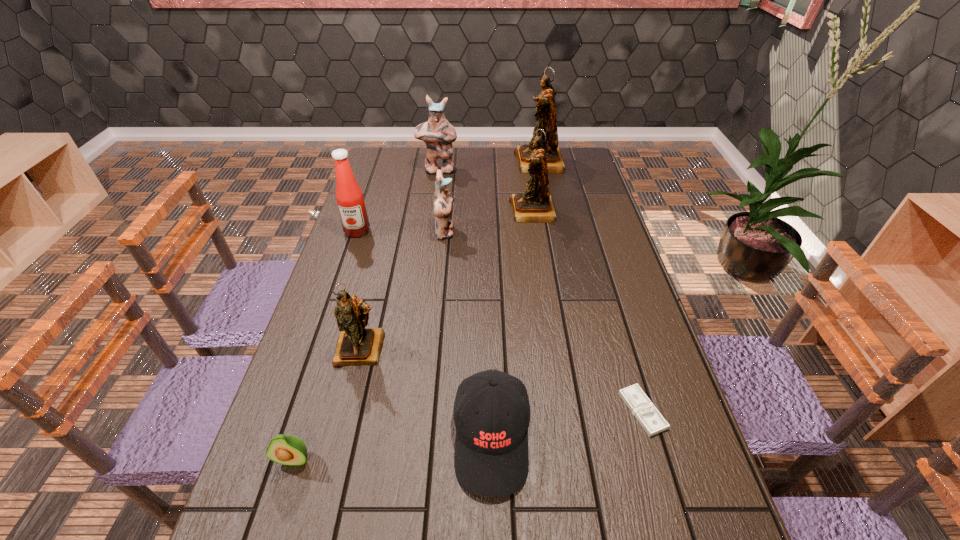
Select which figurine appears as the third closest to the green avocado. Please provide its 2D coordinates. Your answer should be formatted as a tuple, i.e. [(x, y)], where the tuple contains the x and y coordinates of a point satisfying the conditions above.

[(535, 205)]

Select which figurine is the second closest to the second biggest gold figurine. Please provide its 2D coordinates. Your answer should be formatted as a tuple, i.e. [(x, y)], where the tuple contains the x and y coordinates of a point satisfying the conditions above.

[(443, 201)]

Where is `gold figurine that is the closest to the smaller pink figurine`? gold figurine that is the closest to the smaller pink figurine is located at coordinates (535, 205).

Choose which gold figurine is the third nearest neighbor to the condiment. Please provide its 2D coordinates. Your answer should be formatted as a tuple, i.e. [(x, y)], where the tuple contains the x and y coordinates of a point satisfying the conditions above.

[(546, 117)]

The height and width of the screenshot is (540, 960). Find the location of `vacant space that satisfies the following two spatial constraints: 1. on the front-facing side of the second nearest gold figurine; 2. on the front-facing side of the black baseball cap`. vacant space that satisfies the following two spatial constraints: 1. on the front-facing side of the second nearest gold figurine; 2. on the front-facing side of the black baseball cap is located at coordinates (567, 438).

Locate an element on the screen. The height and width of the screenshot is (540, 960). free location that satisfies the following two spatial constraints: 1. on the front-facing side of the shortest object; 2. on the right side of the fourth nearest object is located at coordinates (347, 411).

Find the location of a particular element. free point that satisfies the following two spatial constraints: 1. on the front-facing side of the tallest figurine; 2. on the front-facing side of the red condiment is located at coordinates (553, 231).

At what (x,y) coordinates should I click in order to perform the action: click on blank area in the image that satisfies the following two spatial constraints: 1. on the front-facing side of the second smallest gold figurine; 2. on the front-facing side of the nearest figurine. Please return your answer as a coordinate pair (x, y). Looking at the image, I should click on (553, 348).